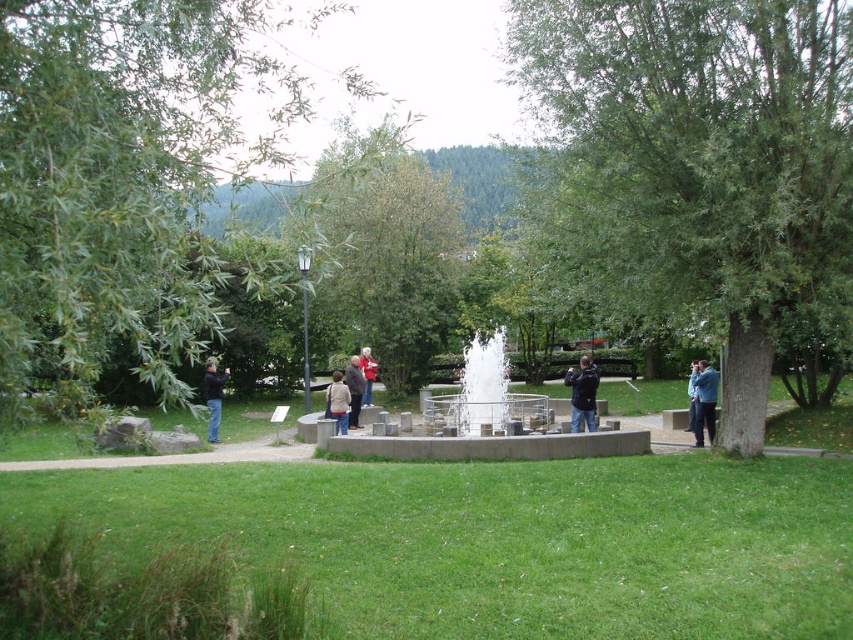
Can you confirm if blue denim jacket at right is positioned to the left of dark blue jeans at left?

No, blue denim jacket at right is not to the left of dark blue jeans at left.

Is blue denim jacket at right to the right of dark blue jeans at left from the viewer's perspective?

Correct, you'll find blue denim jacket at right to the right of dark blue jeans at left.

The image size is (853, 640). What do you see at coordinates (704, 401) in the screenshot?
I see `blue denim jacket at right` at bounding box center [704, 401].

Locate an element on the screen. The image size is (853, 640). blue denim jacket at right is located at coordinates (704, 401).

Can you confirm if white concrete fountain at center is thinner than dark blue jacket at center?

In fact, white concrete fountain at center might be wider than dark blue jacket at center.

Which is more to the left, white concrete fountain at center or dark blue jacket at center?

white concrete fountain at center

Image resolution: width=853 pixels, height=640 pixels. Find the location of `white concrete fountain at center`. white concrete fountain at center is located at coordinates (485, 422).

Looking at this image, is white concrete fountain at center smaller than dark blue jeans at left?

Incorrect, white concrete fountain at center is not smaller in size than dark blue jeans at left.

What do you see at coordinates (485, 422) in the screenshot?
I see `white concrete fountain at center` at bounding box center [485, 422].

In order to click on white concrete fountain at center in this screenshot , I will do `click(485, 422)`.